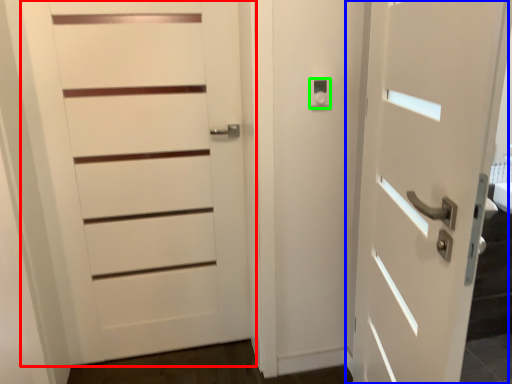
Question: Which object is the farthest from door (highlighted by a red box)? Choose among these: door (highlighted by a blue box) or knob (highlighted by a green box).

Choices:
 (A) door
 (B) knob

Answer: (A)